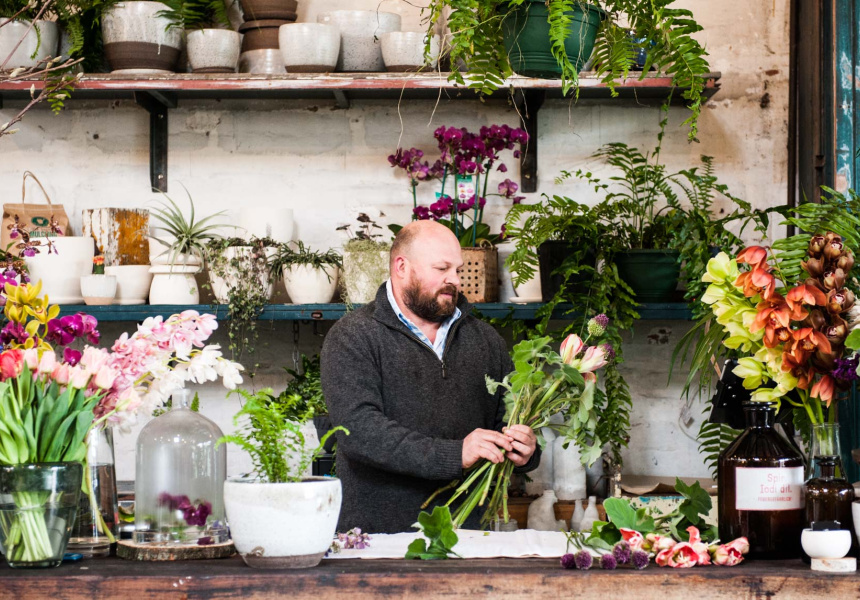
Find the location of a particular element. This screenshot has height=600, width=860. brown wooden rustic table is located at coordinates (463, 579).